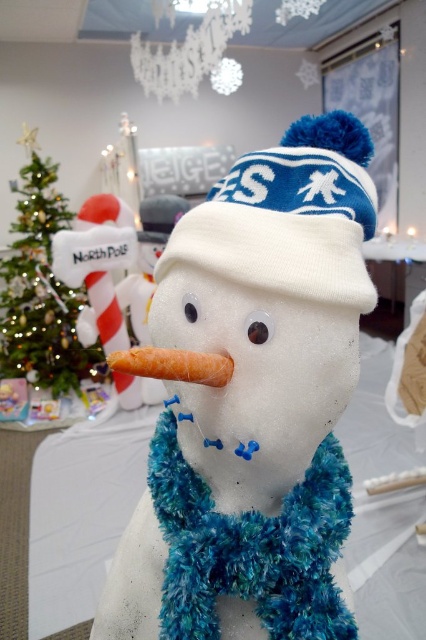
You are trying to decide which item to place in a small gift box. The box can only fit items narrower than 10 cm. You have the fuzzy blue scarf at center and the white knit hat at center. Based on their widths, which item can fit into the box?

The fuzzy blue scarf at center has a width less than the white knit hat at center. Since the box can only fit items narrower than 10 cm, the fuzzy blue scarf at center is the one that can fit into the box.

You are a delivery person who needs to place a large box between the white fabric snowman at center and the green shiny christmas tree at left. The box requires 4 feet of space. Can you fit the box between them?

The white fabric snowman at center and the green shiny christmas tree at left are 3.92 feet apart, so the box requiring 4 feet of space cannot fit between them as the available space is slightly less than needed.